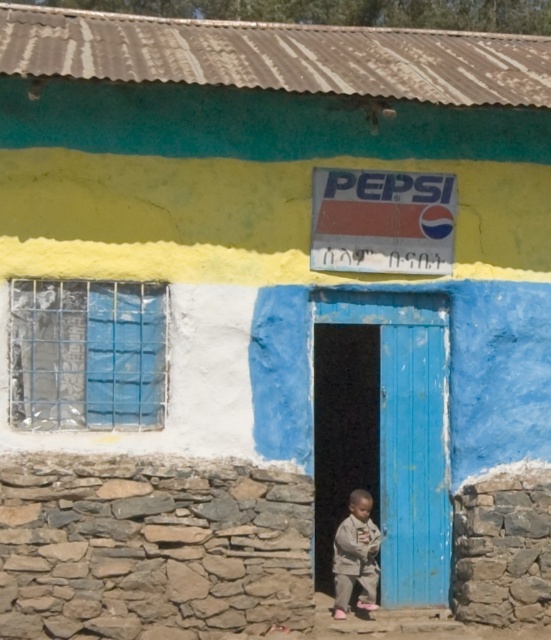
From the picture: You are standing in front of the building and want to place a sticker on the wall. You have two points marked on the wall at coordinates point (x=440, y=531) and point (x=334, y=536). If you want to place the sticker closer to your current position, which point should you choose?

You should choose point (x=440, y=531) because it is closer to the camera than point (x=334, y=536).

You are standing in front of the blue wooden door at center and want to take a photo of the Pepsi advertisement on the wall. The camera is 12.31 meters away from the door. Can you estimate how far you need to walk backward to position the camera at a distance where the entire Pepsi advertisement fits in the frame?

The camera is 12.31 meters away from the blue wooden door at center. To ensure the entire Pepsi advertisement fits in the frame, you would need to maintain this distance. Therefore, you don not need to walk backward further as the camera is already positioned at the required distance of 12.31 meters from the door.

You are standing in front of the rustic building and want to enter through the blue wooden door at center. However, there are light brown fabric pants at lower center blocking your path. Can you still pass through the doorway?

The blue wooden door at center is wider than the light brown fabric pants at lower center, so you can pass through the doorway as there is enough space around the pants.